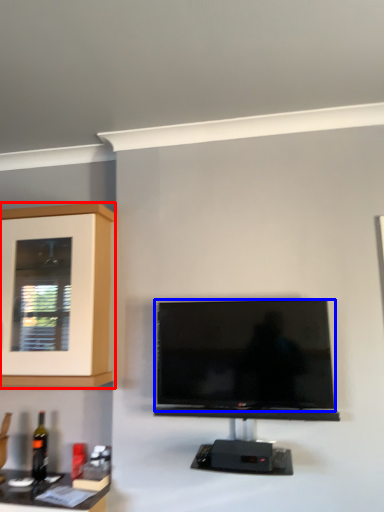
Question: Which object is further to the camera taking this photo, cabinetry (highlighted by a red box) or television (highlighted by a blue box)?

Choices:
 (A) cabinetry
 (B) television

Answer: (A)